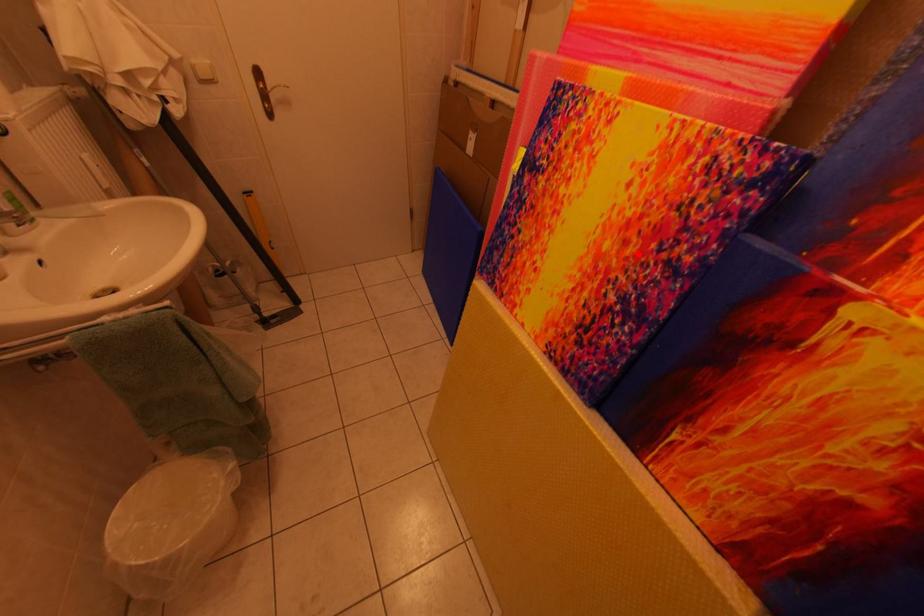
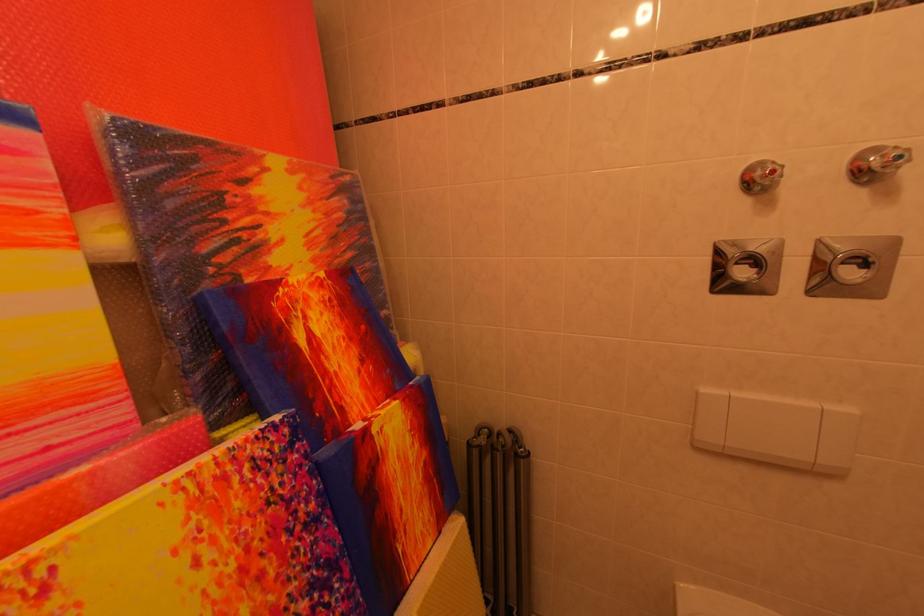
Question: I am providing you with two images of the same scene from different viewpoints. A red point is marked on the first image. Is the red point's position out of view in image 2?

Choices:
 (A) Yes
 (B) No

Answer: (B)